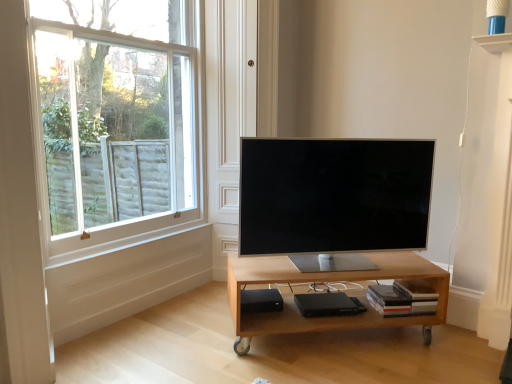
From the picture: What is the approximate height of white wood window at upper left?

white wood window at upper left is 4.59 feet tall.

You are a GUI agent. You are given a task and a screenshot of the screen. Output one action in this format:
    pyautogui.click(x=<x>, y=<y>)
    Task: Click on the black matte speaker at lower center
    The height and width of the screenshot is (384, 512).
    Given the screenshot: What is the action you would take?
    pyautogui.click(x=261, y=301)

The width and height of the screenshot is (512, 384). In order to click on white wood window at upper left in this screenshot , I will do (x=117, y=119).

Considering the sizes of objects light wood/matte table at center and satin silver tv at center in the image provided, who is bigger, light wood/matte table at center or satin silver tv at center?

With larger size is light wood/matte table at center.

From the image's perspective, who appears lower, light wood/matte table at center or satin silver tv at center?

From the image's view, light wood/matte table at center is below.

Which of these two, light wood/matte table at center or satin silver tv at center, stands shorter?

light wood/matte table at center is shorter.

From a real-world perspective, relative to satin silver tv at center, is light wood/matte table at center vertically above or below?

light wood/matte table at center is situated lower than satin silver tv at center in the real world.

Considering the relative positions of satin silver tv at center and black matte speaker at lower center in the image provided, is satin silver tv at center to the left or to the right of black matte speaker at lower center?

satin silver tv at center is to the right of black matte speaker at lower center.

Is point (272, 180) positioned behind point (261, 300)?

No, (272, 180) is closer to viewer.

Is satin silver tv at center thinner than black matte speaker at lower center?

In fact, satin silver tv at center might be wider than black matte speaker at lower center.

Does satin silver tv at center have a larger size compared to black matte speaker at lower center?

Correct, satin silver tv at center is larger in size than black matte speaker at lower center.

Considering the sizes of objects light wood/matte table at center and white wood window at upper left in the image provided, who is wider, light wood/matte table at center or white wood window at upper left?

Wider between the two is light wood/matte table at center.

In the scene shown: Visually, is light wood/matte table at center positioned to the left or to the right of white wood window at upper left?

Based on their positions, light wood/matte table at center is located to the right of white wood window at upper left.

Is white wood window at upper left completely or partially inside light wood/matte table at center?

No, white wood window at upper left is located outside of light wood/matte table at center.

Where is `window above the light wood/matte table at center (from a real-world perspective)`? This screenshot has height=384, width=512. window above the light wood/matte table at center (from a real-world perspective) is located at coordinates (117, 119).

From a real-world perspective, relative to satin silver tv at center, is black matte speaker at lower center vertically above or below?

Clearly, from a real-world perspective, black matte speaker at lower center is below satin silver tv at center.

In terms of size, does black matte speaker at lower center appear bigger or smaller than satin silver tv at center?

black matte speaker at lower center is smaller than satin silver tv at center.

In the image, there is a black matte speaker at lower center. Where is `television above it (from the image's perspective)`? television above it (from the image's perspective) is located at coordinates (333, 195).

Considering the sizes of objects black matte speaker at lower center and satin silver tv at center in the image provided, who is wider, black matte speaker at lower center or satin silver tv at center?

satin silver tv at center is wider.

Who is taller, white wood window at upper left or black matte speaker at lower center?

With more height is white wood window at upper left.

Is point (120, 80) farther from viewer compared to point (277, 298)?

That is True.

Does white wood window at upper left appear on the left side of black matte speaker at lower center?

Indeed, white wood window at upper left is positioned on the left side of black matte speaker at lower center.

Considering the relative sizes of white wood window at upper left and black matte speaker at lower center in the image provided, is white wood window at upper left smaller than black matte speaker at lower center?

No.

Is black matte speaker at lower center wider than white wood window at upper left?

Indeed, black matte speaker at lower center has a greater width compared to white wood window at upper left.

Is black matte speaker at lower center far away from white wood window at upper left?

That's right, there is a large distance between black matte speaker at lower center and white wood window at upper left.

Does black matte speaker at lower center lie behind white wood window at upper left?

Yes, it is.

Considering the points (250, 299) and (106, 165), which point is in front, point (250, 299) or point (106, 165)?

The point (250, 299) is closer.

Which of these two, white wood window at upper left or light wood/matte table at center, is thinner?

white wood window at upper left.

Is white wood window at upper left positioned beyond the bounds of light wood/matte table at center?

Yes.

Does white wood window at upper left have a smaller size compared to light wood/matte table at center?

Incorrect, white wood window at upper left is not smaller in size than light wood/matte table at center.

From the image's perspective, which one is positioned higher, white wood window at upper left or light wood/matte table at center?

From the image's view, white wood window at upper left is above.

Identify the location of table lying on the left of satin silver tv at center. Image resolution: width=512 pixels, height=384 pixels. (328, 282).

You are a GUI agent. You are given a task and a screenshot of the screen. Output one action in this format:
    pyautogui.click(x=<x>, y=<y>)
    Task: Click on the television that is on the right side of black matte speaker at lower center
    The width and height of the screenshot is (512, 384).
    Given the screenshot: What is the action you would take?
    pyautogui.click(x=333, y=195)

Looking at the image, which one is located further to white wood window at upper left, light wood/matte table at center or black matte speaker at lower center?

Based on the image, black matte speaker at lower center appears to be further to white wood window at upper left.

Considering their positions, is black matte speaker at lower center positioned further to white wood window at upper left than satin silver tv at center?

Based on the image, black matte speaker at lower center appears to be further to white wood window at upper left.

When comparing their distances from light wood/matte table at center, does white wood window at upper left or satin silver tv at center seem closer?

The object closer to light wood/matte table at center is satin silver tv at center.

From the image, which object appears to be nearer to black matte speaker at lower center, light wood/matte table at center or white wood window at upper left?

The object closer to black matte speaker at lower center is light wood/matte table at center.

Which object lies further to the anchor point black matte speaker at lower center, satin silver tv at center or white wood window at upper left?

white wood window at upper left lies further to black matte speaker at lower center than the other object.

Considering their positions, is satin silver tv at center positioned closer to white wood window at upper left than light wood/matte table at center?

The object closer to white wood window at upper left is satin silver tv at center.

Estimate the real-world distances between objects in this image. Which object is closer to black matte speaker at lower center, white wood window at upper left or satin silver tv at center?

satin silver tv at center lies closer to black matte speaker at lower center than the other object.

From the image, which object appears to be nearer to white wood window at upper left, satin silver tv at center or black matte speaker at lower center?

satin silver tv at center lies closer to white wood window at upper left than the other object.

Identify the location of table located between white wood window at upper left and satin silver tv at center in the left-right direction. Image resolution: width=512 pixels, height=384 pixels. (328, 282).

The image size is (512, 384). What are the coordinates of `speaker between white wood window at upper left and satin silver tv at center from left to right` in the screenshot? It's located at (261, 301).

I want to click on table between satin silver tv at center and black matte speaker at lower center in the up-down direction, so click(x=328, y=282).

Where is `table that lies between white wood window at upper left and black matte speaker at lower center from top to bottom`? This screenshot has width=512, height=384. table that lies between white wood window at upper left and black matte speaker at lower center from top to bottom is located at coordinates (328, 282).